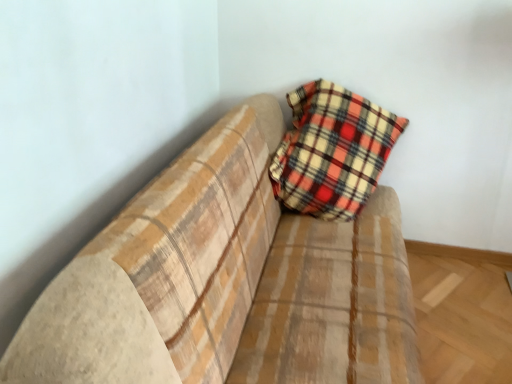
Question: Does plaid fabric couch at upper right appear on the right side of plaid fabric pillow at center?

Choices:
 (A) yes
 (B) no

Answer: (B)

Question: Is plaid fabric couch at upper right surrounding plaid fabric pillow at center?

Choices:
 (A) no
 (B) yes

Answer: (B)

Question: Is plaid fabric couch at upper right wider than plaid fabric pillow at center?

Choices:
 (A) no
 (B) yes

Answer: (B)

Question: Is plaid fabric couch at upper right in contact with plaid fabric pillow at center?

Choices:
 (A) no
 (B) yes

Answer: (A)

Question: From a real-world perspective, is plaid fabric couch at upper right physically above plaid fabric pillow at center?

Choices:
 (A) no
 (B) yes

Answer: (A)

Question: Is plaid fabric couch at upper right aimed at plaid fabric pillow at center?

Choices:
 (A) yes
 (B) no

Answer: (B)

Question: Can you confirm if plaid fabric pillow at center is wider than plaid fabric couch at upper right?

Choices:
 (A) yes
 (B) no

Answer: (B)

Question: Considering the relative sizes of plaid fabric pillow at center and plaid fabric couch at upper right in the image provided, is plaid fabric pillow at center bigger than plaid fabric couch at upper right?

Choices:
 (A) no
 (B) yes

Answer: (A)

Question: Can you confirm if plaid fabric pillow at center is positioned to the right of plaid fabric couch at upper right?

Choices:
 (A) yes
 (B) no

Answer: (A)

Question: Could you tell me if plaid fabric pillow at center is turned towards plaid fabric couch at upper right?

Choices:
 (A) yes
 (B) no

Answer: (A)

Question: Is plaid fabric pillow at center beside plaid fabric couch at upper right?

Choices:
 (A) yes
 (B) no

Answer: (B)

Question: Is plaid fabric pillow at center closer to camera compared to plaid fabric couch at upper right?

Choices:
 (A) yes
 (B) no

Answer: (B)

Question: Looking at their shapes, would you say plaid fabric couch at upper right is wider or thinner than plaid fabric pillow at center?

Choices:
 (A) wide
 (B) thin

Answer: (A)